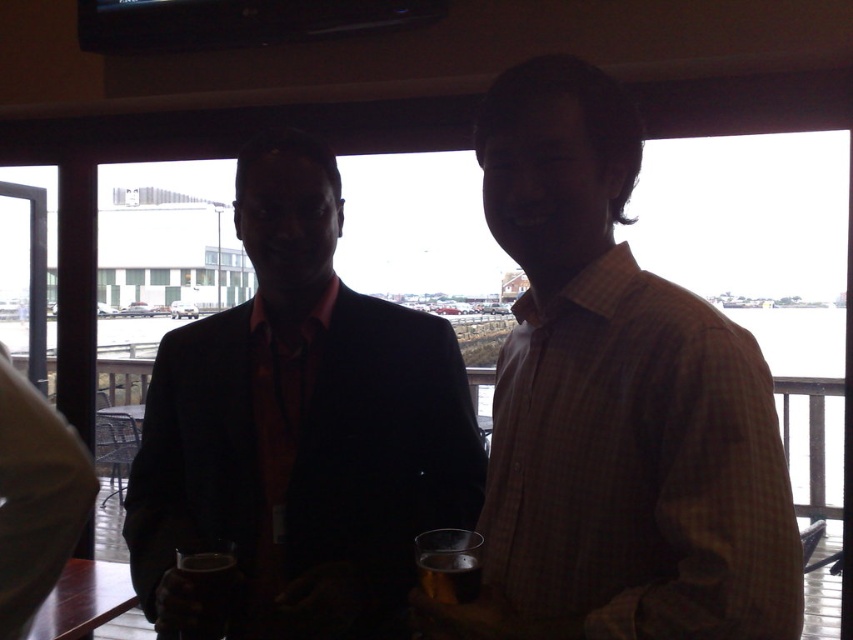
Question: Is matte black suit at center bigger than translucent glass mug at lower left?

Choices:
 (A) yes
 (B) no

Answer: (A)

Question: Which object appears closest to the camera in this image?

Choices:
 (A) matte black suit at center
 (B) translucent glass at center

Answer: (B)

Question: Observing the image, what is the correct spatial positioning of translucent glass mug at lower left in reference to translucent glass at center?

Choices:
 (A) below
 (B) above

Answer: (A)

Question: Which object is positioned farthest from the translucent glass mug at lower left?

Choices:
 (A) brown checkered shirt at center
 (B) translucent glass at center

Answer: (A)

Question: Does matte black suit at center have a smaller size compared to translucent glass mug at lower left?

Choices:
 (A) no
 (B) yes

Answer: (A)

Question: Which of these objects is positioned farthest from the translucent glass mug at lower left?

Choices:
 (A) translucent glass at center
 (B) brown checkered shirt at center
 (C) matte black suit at center

Answer: (B)